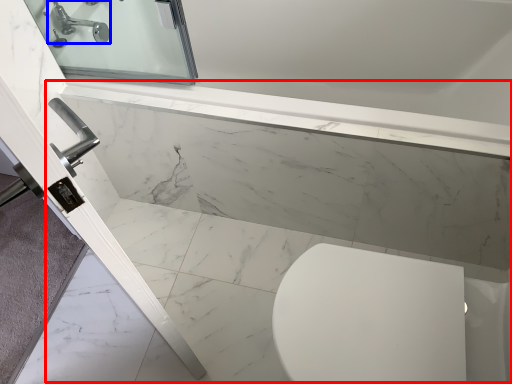
Question: Which object is further to the camera taking this photo, bath (highlighted by a red box) or tap (highlighted by a blue box)?

Choices:
 (A) bath
 (B) tap

Answer: (B)